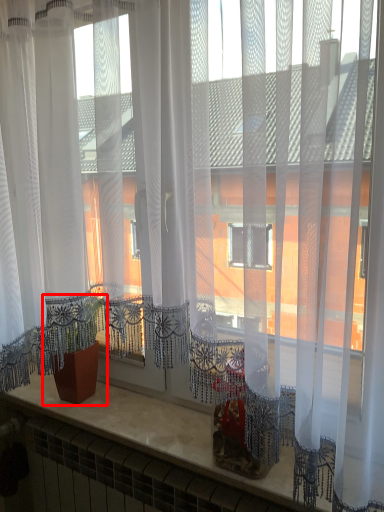
Question: From the image's perspective, what is the correct spatial relationship of houseplant (annotated by the red box) in relation to counter top?

Choices:
 (A) above
 (B) below

Answer: (A)